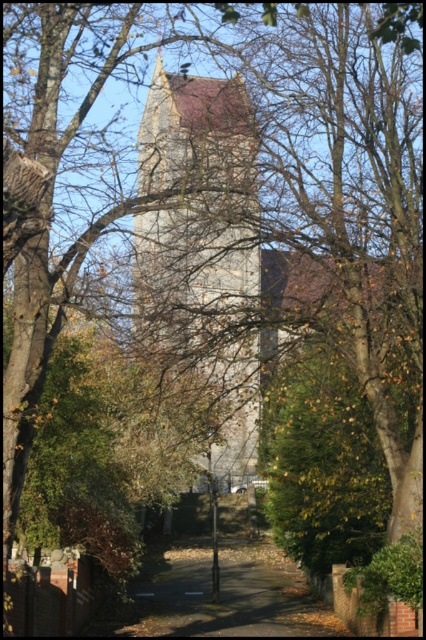
Does stone tower at center appear on the left side of dirt path at center?

Indeed, stone tower at center is positioned on the left side of dirt path at center.

Is point (221, 195) closer to camera compared to point (158, 577)?

Yes.

Locate an element on the screen. Image resolution: width=426 pixels, height=640 pixels. stone tower at center is located at coordinates (203, 248).